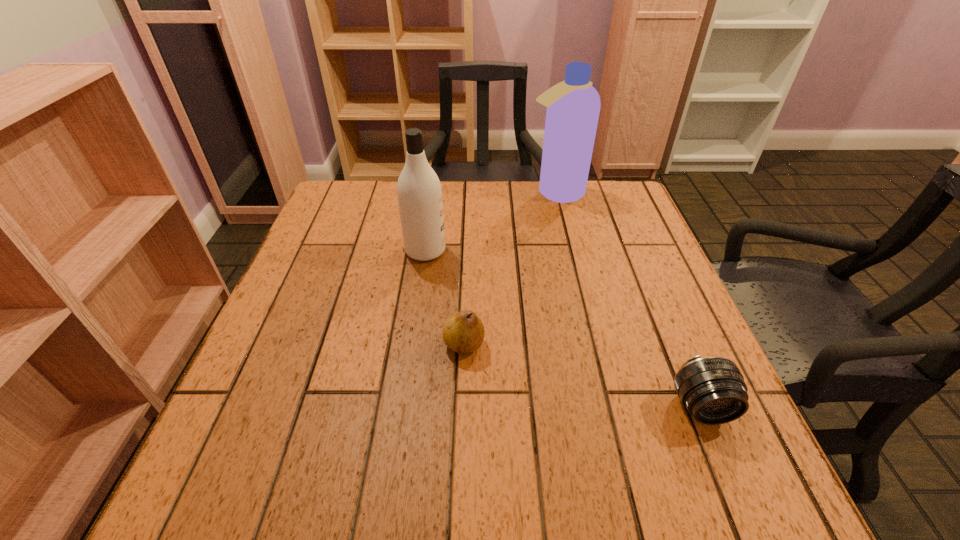
In order to click on the right shampoo in this screenshot , I will do `click(573, 106)`.

This screenshot has width=960, height=540. Identify the location of the farther shampoo. (573, 106).

The image size is (960, 540). I want to click on the nearer shampoo, so click(x=419, y=192).

At what (x,y) coordinates should I click in order to perform the action: click on the second farthest object. Please return your answer as a coordinate pair (x, y). Looking at the image, I should click on pyautogui.click(x=419, y=192).

The image size is (960, 540). I want to click on pear, so click(x=463, y=332).

Where is `the third object from right to left`? The image size is (960, 540). the third object from right to left is located at coordinates (463, 332).

Find the location of `the rightmost object`. the rightmost object is located at coordinates (712, 389).

Identify the location of telephoto lens. (712, 389).

At what (x,y) coordinates should I click in order to perform the action: click on vacant space located 0.340m on the left of the third object from left to right. Please return your answer as a coordinate pair (x, y). Looking at the image, I should click on (408, 193).

Where is `free space located on the front-facing side of the nearer shampoo`? free space located on the front-facing side of the nearer shampoo is located at coordinates (541, 251).